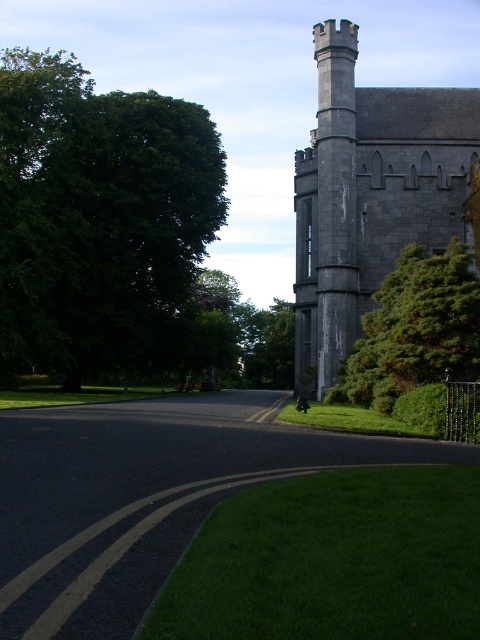
You are a tourist standing on the road and looking towards the gray stone tower at upper right and the green textured bush at right. Which object is higher from your viewpoint?

The gray stone tower at upper right is higher than the green textured bush at right because it is positioned over it.

Looking at this image, you are a tourist standing on the road and looking at the gray stone tower at upper right and the green leafy tree at left. Which object is positioned higher in the image?

The green leafy tree at left is located above the gray stone tower at upper right in the image.